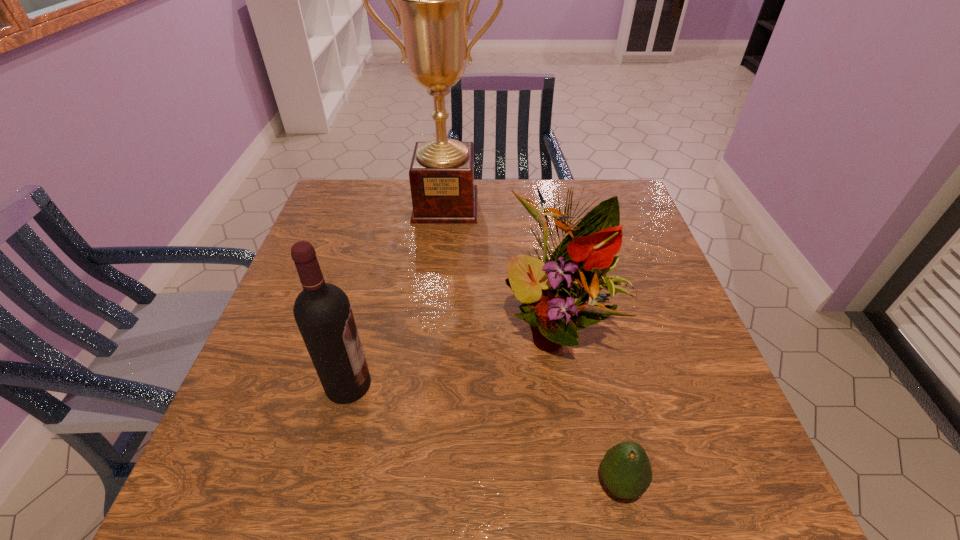
This screenshot has height=540, width=960. In order to click on the farthest object in this screenshot , I will do `click(433, 0)`.

Locate an element on the screen. The image size is (960, 540). the tallest object is located at coordinates (433, 0).

Where is `wine bottle`? This screenshot has width=960, height=540. wine bottle is located at coordinates click(322, 311).

Locate an element on the screen. The height and width of the screenshot is (540, 960). bouquet is located at coordinates (553, 294).

Locate an element on the screen. This screenshot has width=960, height=540. the shortest object is located at coordinates (626, 470).

In order to click on the nearest object in this screenshot , I will do `click(626, 470)`.

Where is `free space located 0.380m on the plaque of the trophy cup`? The image size is (960, 540). free space located 0.380m on the plaque of the trophy cup is located at coordinates (434, 323).

At what (x,y) coordinates should I click in order to perform the action: click on vacant point located 0.340m on the label of the wine bottle. Please return your answer as a coordinate pair (x, y). Image resolution: width=960 pixels, height=540 pixels. Looking at the image, I should click on (541, 384).

Locate an element on the screen. The height and width of the screenshot is (540, 960). free spot located 0.130m on the front-facing side of the bouquet is located at coordinates (575, 439).

This screenshot has width=960, height=540. I want to click on vacant space located on the back of the avocado, so click(589, 350).